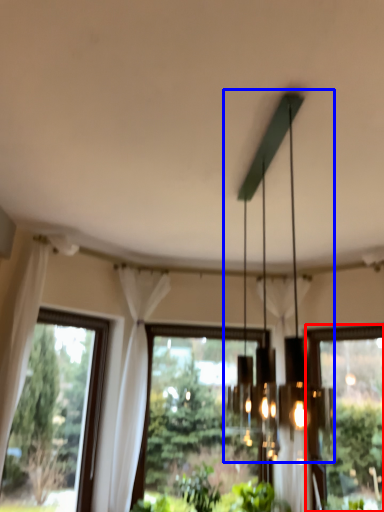
Question: Which object is closer to the camera taking this photo, window (highlighted by a red box) or chandelier (highlighted by a blue box)?

Choices:
 (A) window
 (B) chandelier

Answer: (B)